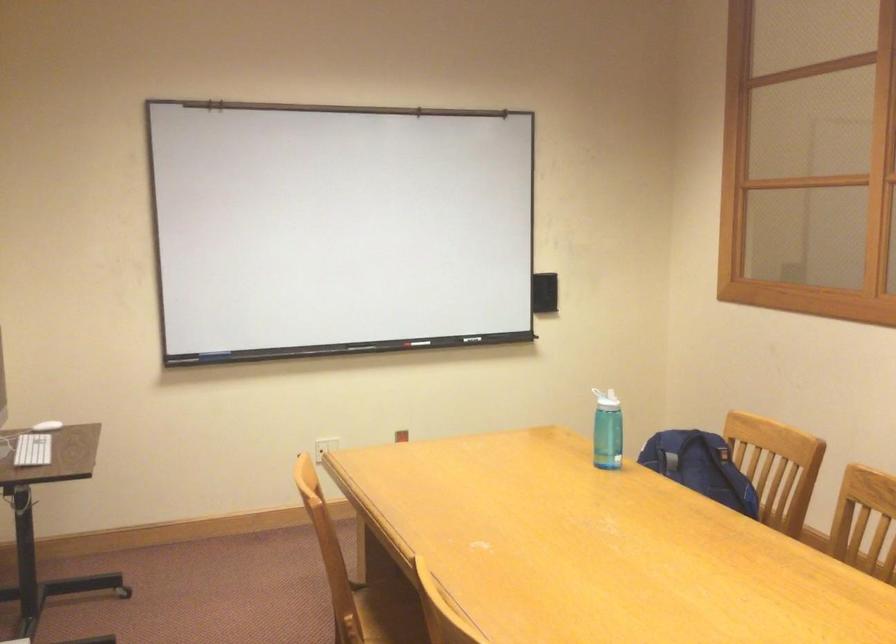
What do you see at coordinates (606, 399) in the screenshot?
I see `the white bottle lid` at bounding box center [606, 399].